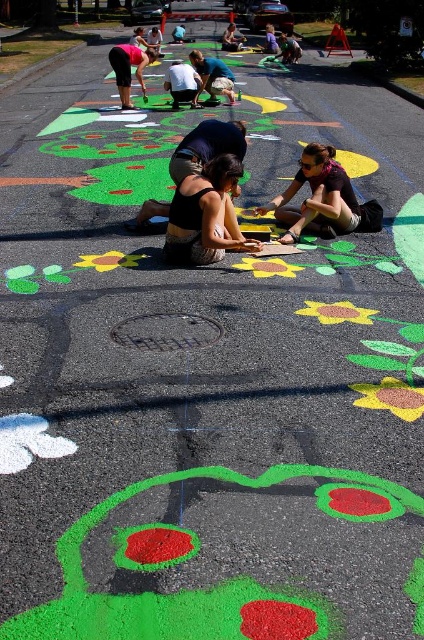
Question: Can you confirm if matte black shirt at center is positioned to the left of matte black shorts at upper left?

Choices:
 (A) no
 (B) yes

Answer: (A)

Question: Estimate the real-world distances between objects in this image. Which object is farther from the matte black shorts at upper left?

Choices:
 (A) matte black tank top at center
 (B) matte black shirt at center

Answer: (A)

Question: Does matte black shirt at center appear on the right side of matte black shorts at upper left?

Choices:
 (A) no
 (B) yes

Answer: (B)

Question: Which of the following is the closest to the observer?

Choices:
 (A) matte black tank top at center
 (B) matte black shirt at center

Answer: (A)

Question: Does matte black tank top at center have a greater width compared to matte black shirt at center?

Choices:
 (A) no
 (B) yes

Answer: (A)

Question: Which is nearer to the matte black shirt at center?

Choices:
 (A) matte black shorts at upper left
 (B) matte black tank top at center

Answer: (B)